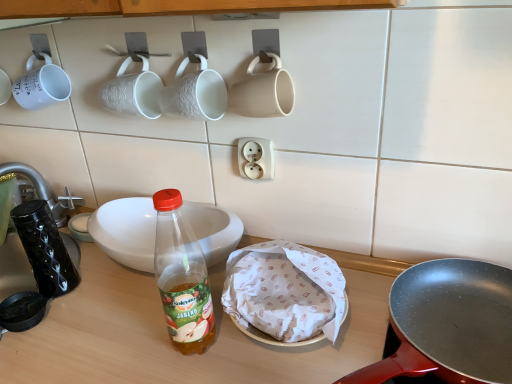
Identify the location of spots to the right of white paper wrapped food at center. (390, 312).